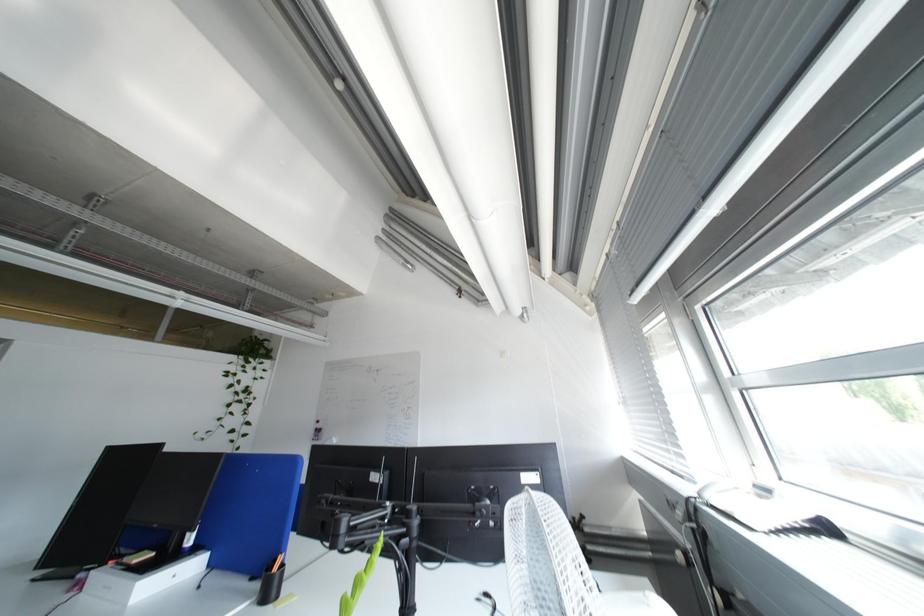
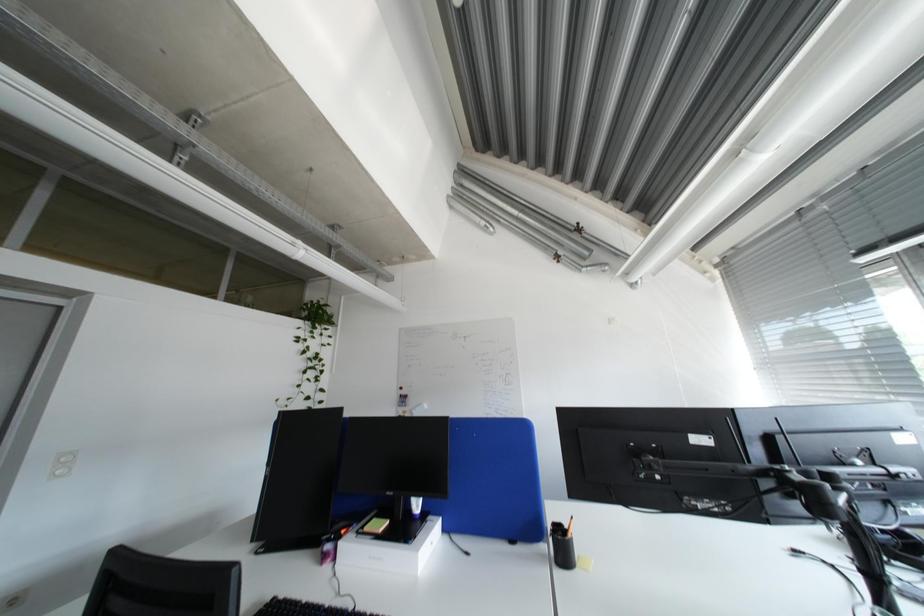
Question: The images are taken continuously from a first-person perspective. In which direction are you moving?

Choices:
 (A) Left
 (B) Right
 (C) Forward
 (D) Backward

Answer: (A)